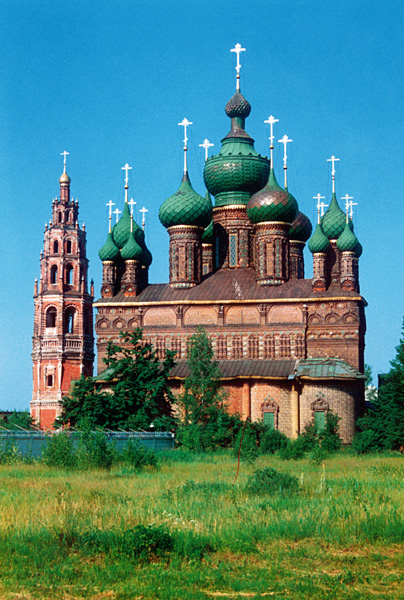
Locate an element on the screen. wall is located at coordinates (39, 442).